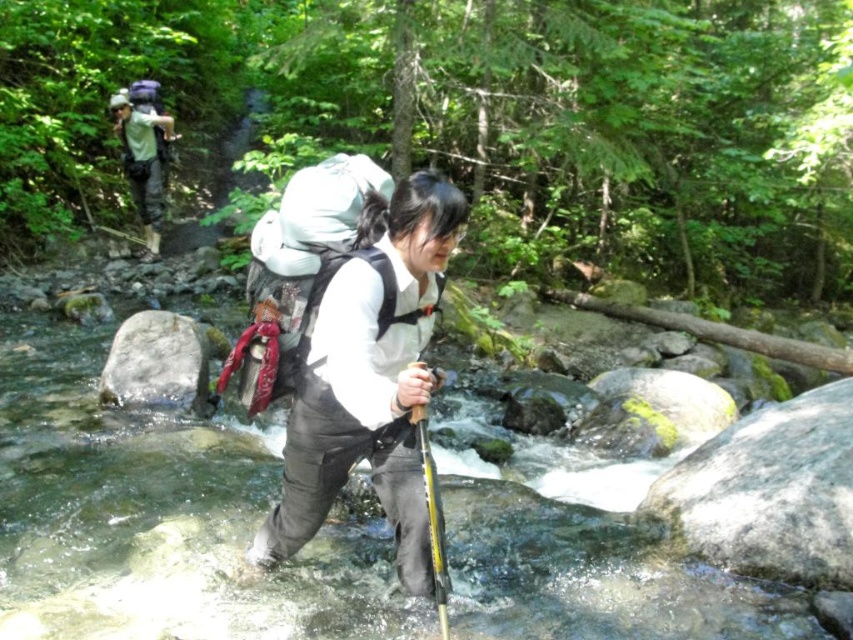
You are planning to cross the stream using the rocks. You see the white matte backpack at center and the gray rough rock at center. Which object can you step on to cross the stream?

The gray rough rock at center is the object you can step on to cross the stream because the white matte backpack at center is larger in size but is likely part of the hiker and not a stable stepping stone.